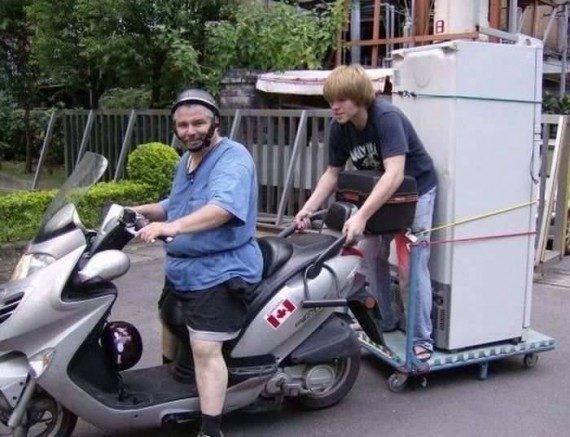
In order to click on mirror in this screenshot , I will do `click(104, 264)`.